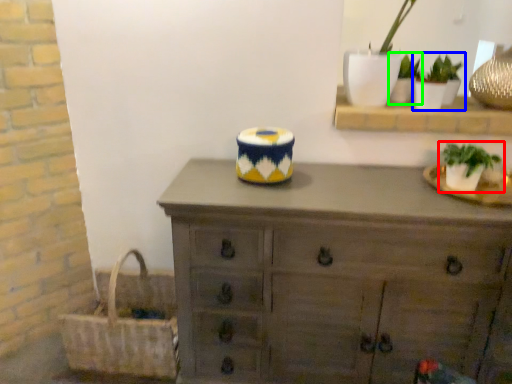
Question: Which object is positioned closest to houseplant (highlighted by a red box)? Select from houseplant (highlighted by a blue box) and houseplant (highlighted by a green box).

Choices:
 (A) houseplant
 (B) houseplant

Answer: (A)